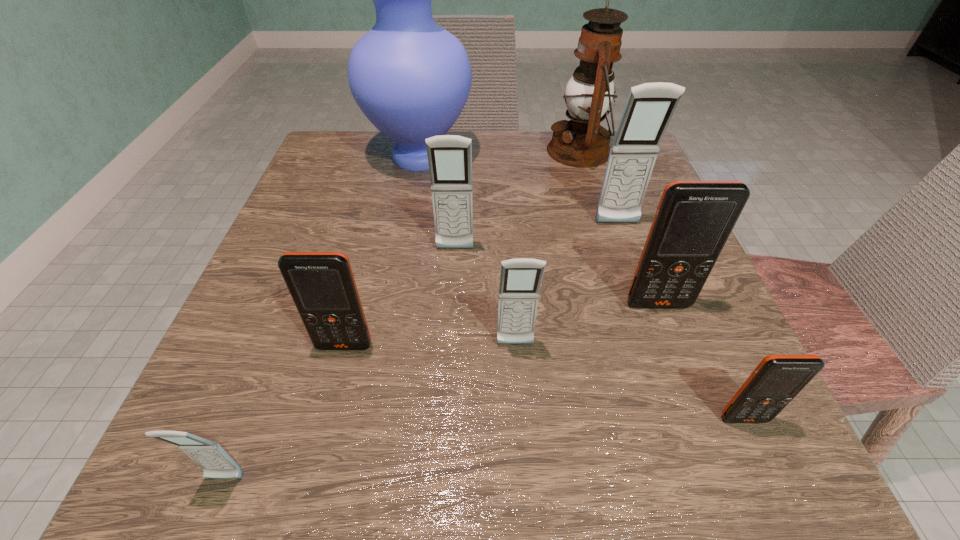
The image size is (960, 540). I want to click on lantern, so click(x=582, y=142).

This screenshot has width=960, height=540. I want to click on blue vase, so click(x=411, y=78).

At what (x,y) coordinates should I click in order to perform the action: click on the tallest cellular telephone. Please return your answer as a coordinate pair (x, y). This screenshot has height=540, width=960. Looking at the image, I should click on (x=650, y=107).

The height and width of the screenshot is (540, 960). I want to click on the seventh nearest object, so [x=650, y=107].

Locate an element on the screen. the second farthest cellular telephone is located at coordinates (449, 156).

Image resolution: width=960 pixels, height=540 pixels. I want to click on the third cellular telephone from left to right, so click(x=449, y=156).

Image resolution: width=960 pixels, height=540 pixels. Find the location of `the farthest orange cellular telephone`. the farthest orange cellular telephone is located at coordinates (694, 219).

Identify the location of the fifth farthest object. (694, 219).

Identify the location of the fifth object from right to left. (520, 279).

Identify the location of the fourth cellular telephone from right to left. (520, 279).